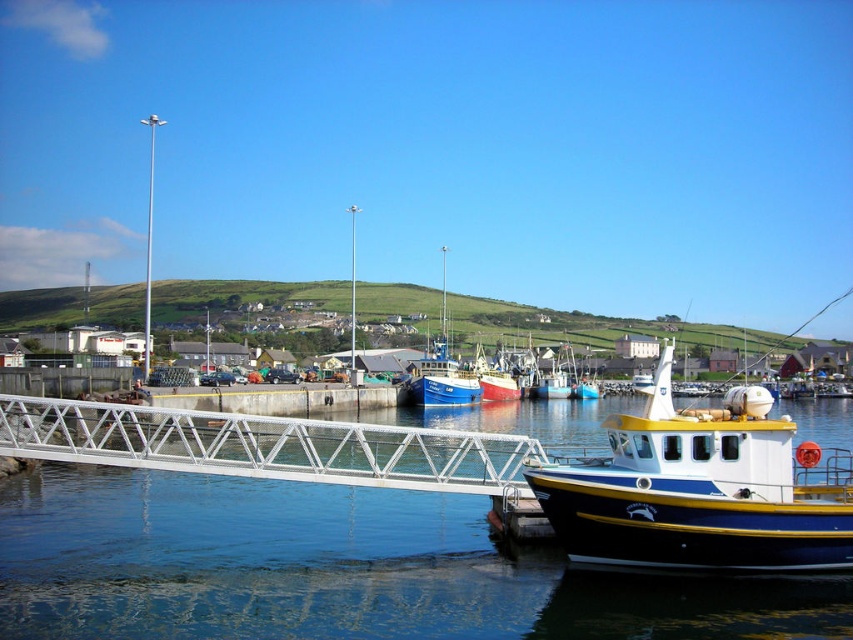
Question: Is blue glossy water at lower center positioned behind blue polished wood boat at lower right?

Choices:
 (A) yes
 (B) no

Answer: (B)

Question: Does blue glossy water at lower center have a larger size compared to concrete dock at center?

Choices:
 (A) no
 (B) yes

Answer: (B)

Question: Which of the following is the closest to the observer?

Choices:
 (A) blue polished wood boat at lower right
 (B) concrete dock at center
 (C) blue glossy water at lower center

Answer: (C)

Question: Where is blue polished wood boat at lower right located in relation to white metallic bridge at lower center in the image?

Choices:
 (A) right
 (B) left

Answer: (A)

Question: Which point is farther from the camera taking this photo?

Choices:
 (A) (164, 394)
 (B) (386, 428)

Answer: (A)

Question: Which object is closer to the camera taking this photo?

Choices:
 (A) blue polished wood boat at lower right
 (B) blue glossy water at lower center
 (C) concrete dock at center

Answer: (B)